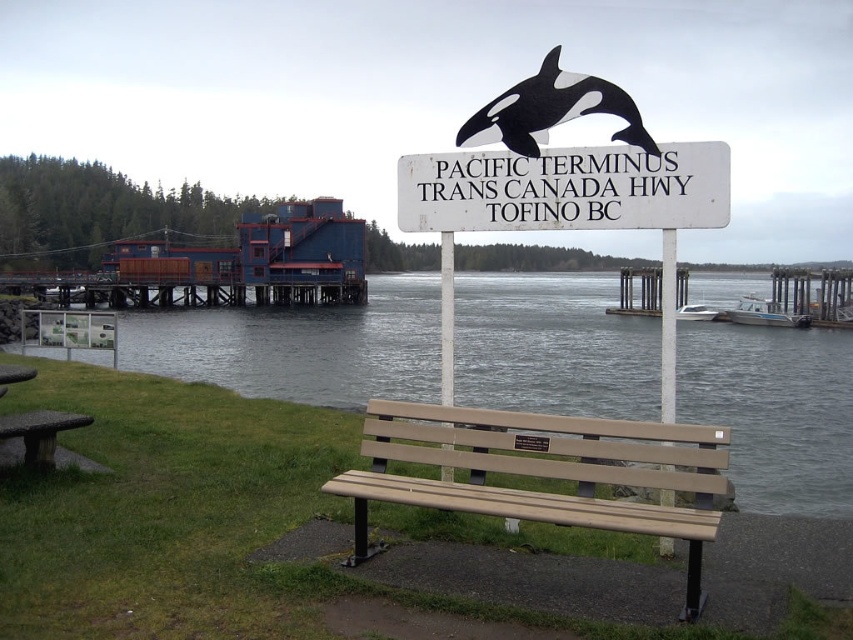
Is tan plastic bench at center closer to camera compared to stone textured picnic table at lower left?

That is True.

Between tan plastic bench at center and stone textured picnic table at lower left, which one has less height?

With less height is stone textured picnic table at lower left.

Who is more forward, [399,477] or [21,436]?

Point [399,477] is in front.

Identify the location of tan plastic bench at center. The width and height of the screenshot is (853, 640). (543, 472).

Is clear water at bench right further to the viewer compared to white wooden sign at center?

Yes, it is behind white wooden sign at center.

Which is more to the right, clear water at bench right or white wooden sign at center?

clear water at bench right is more to the right.

Find the location of a particular element. The height and width of the screenshot is (640, 853). clear water at bench right is located at coordinates (300, 346).

Does black matte orca at upper center lie in front of stone textured picnic table at lower left?

Yes, black matte orca at upper center is closer to the viewer.

Does point (631, 108) come behind point (3, 422)?

No, (631, 108) is closer to viewer.

Locate an element on the screen. Image resolution: width=853 pixels, height=640 pixels. black matte orca at upper center is located at coordinates (550, 109).